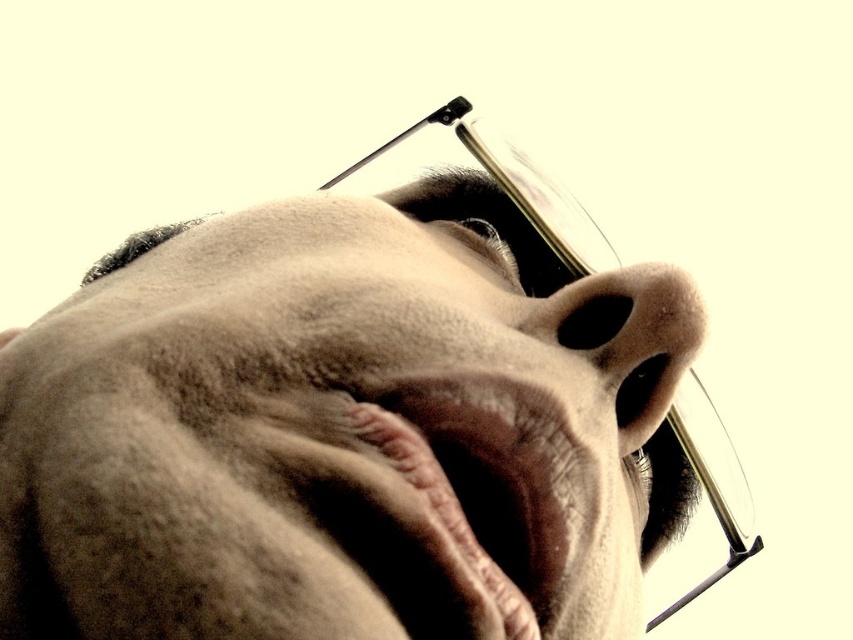
From the picture: You are a photographer adjusting the focus of your camera. You want to ensure that both the matte skin face at center and the smooth skin nose at center are in sharp focus. Given their positions relative to the viewer, which object should you focus on first to achieve this?

The matte skin face at center is closer to the viewer than the smooth skin nose at center. To ensure both are in sharp focus, you should focus on the matte skin face at center first, as it is the closer object.

You are a photographer adjusting the focus on a camera. The subject has a matte skin face at center and a smooth skin nose at center. If your camera can only focus on one object at a time, which should you choose to ensure both are in focus, given their distance apart?

The matte skin face at center and smooth skin nose at center are only 4.15 inches apart, so focusing on either one should keep both in focus due to their close proximity.

Looking at the person in the image, which area has a greater height between the matte skin face at center and the dry skin at center?

The matte skin face at center has a greater height compared to the dry skin at center.